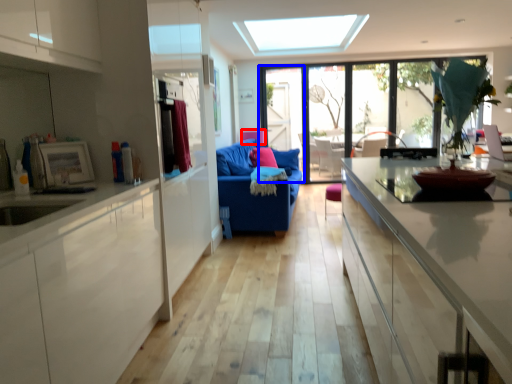
Question: Which object appears farthest to the camera in this image, armchair (highlighted by a red box) or screen door (highlighted by a blue box)?

Choices:
 (A) armchair
 (B) screen door

Answer: (B)